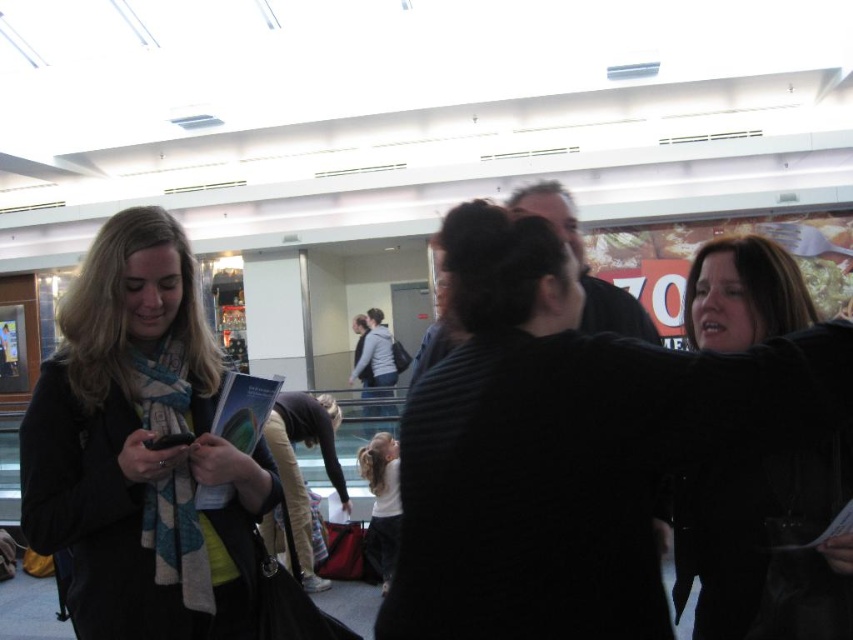
You are a delivery robot in a shopping mall. You need to deliver a package to the person wearing the white cotton shirt at center. You are currently positioned near the black fuzzy coat at right. The robot has a maximum delivery range of 3 meters. Can you reach the person without moving beyond your range?

The distance between the black fuzzy coat at right and the white cotton shirt at center is 3.01 meters. Since the robot has a maximum delivery range of 3 meters, it cannot reach the person without moving beyond its range.

Consider the image. You are a photographer standing in the scene. You want to take a photo that includes both the black fuzzy coat at right and the white cotton shirt at center. Which object should be placed closer to the camera to ensure both are fully visible in the frame?

The black fuzzy coat at right is not as tall as the white cotton shirt at center. To ensure both are fully visible, place the white cotton shirt at center closer to the camera so its height matches the black fuzzy coat at right in the photo.

You are a photographer standing in the scene. You want to take a photo of the black fuzzy coat at right and the white cotton shirt at center. Which one should you zoom in on more to capture both clearly?

The black fuzzy coat at right is smaller than the white cotton shirt at center, so you should zoom in more on the white cotton shirt at center to ensure both are captured clearly.